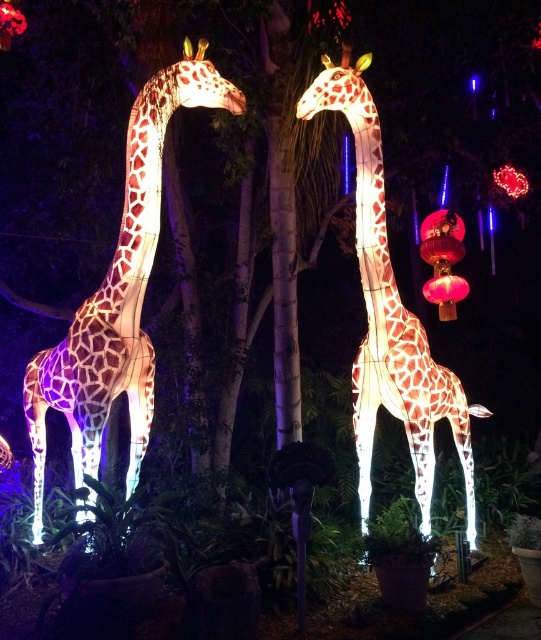
Does illuminated mesh giraffe at left have a lesser width compared to illuminated mesh giraffe at center?

No.

Who is higher up, illuminated mesh giraffe at left or illuminated mesh giraffe at center?

illuminated mesh giraffe at left is higher up.

Identify the location of illuminated mesh giraffe at left. (118, 294).